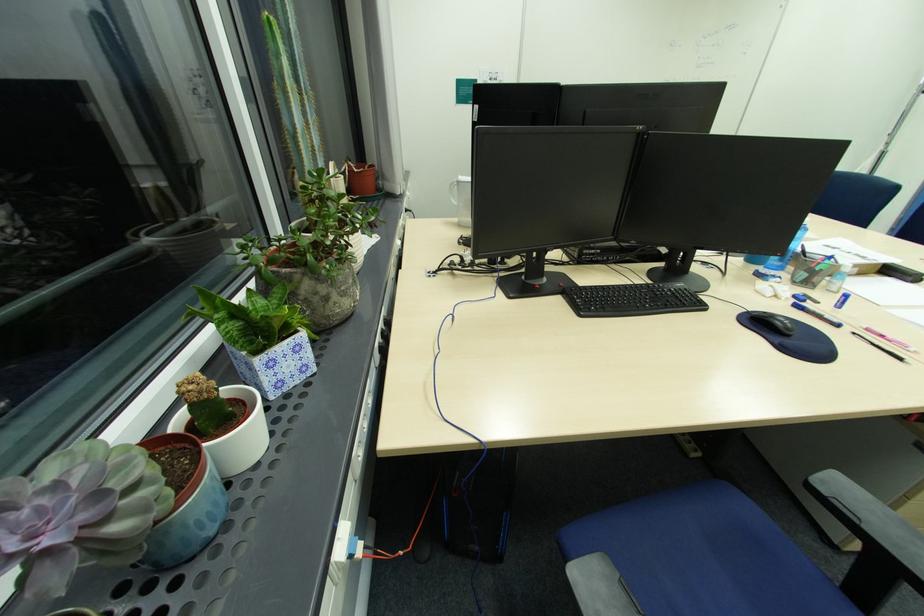
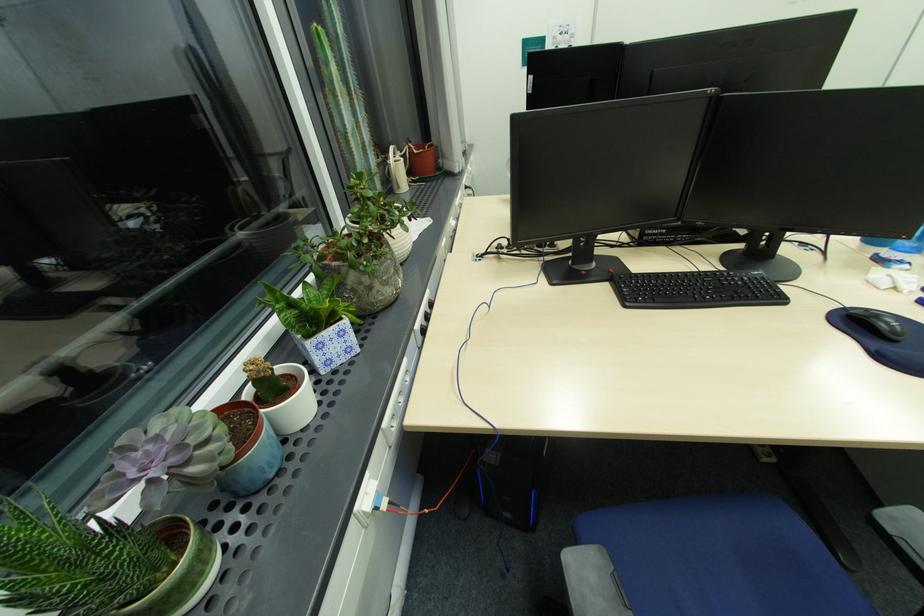
The point at (x=160, y=483) is marked in the first image. Where is the corresponding point in the second image?

(225, 440)